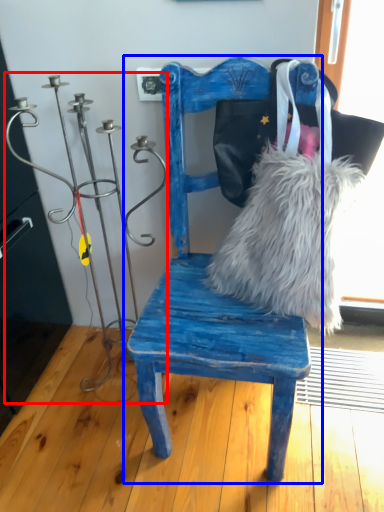
Question: Which object is closer to the camera taking this photo, candle holder (highlighted by a red box) or chair (highlighted by a blue box)?

Choices:
 (A) candle holder
 (B) chair

Answer: (B)